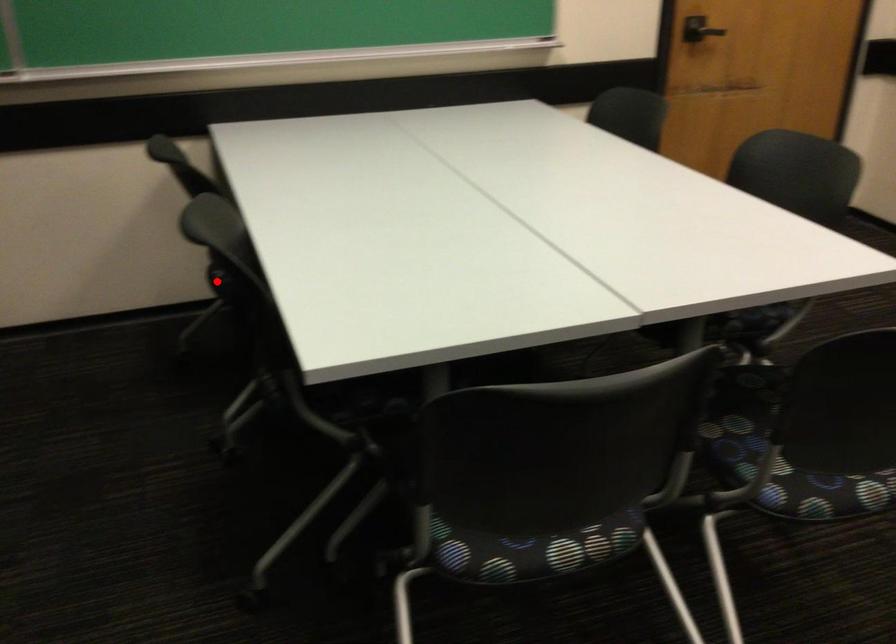
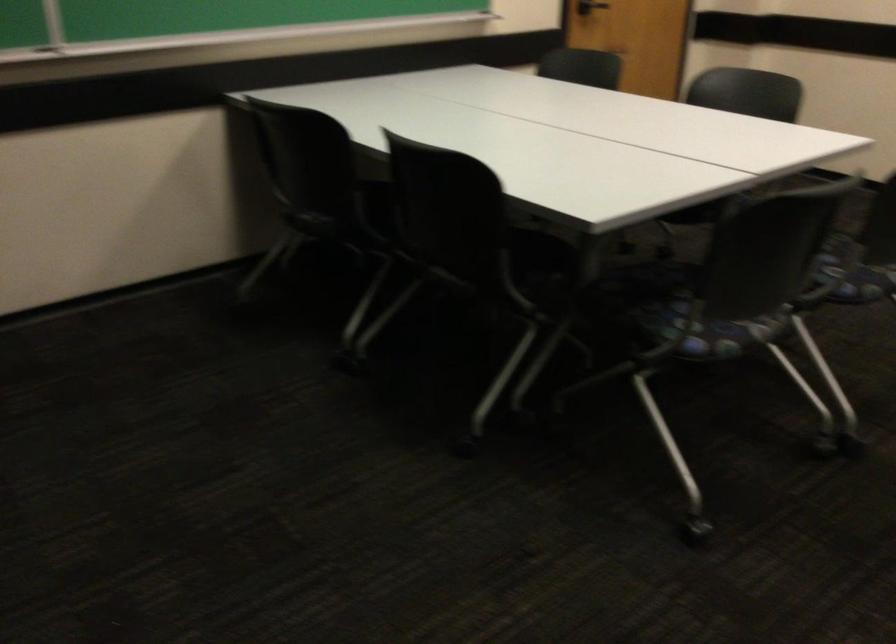
Find the pixel in the second image that matches the highlighted location in the first image.

(320, 225)